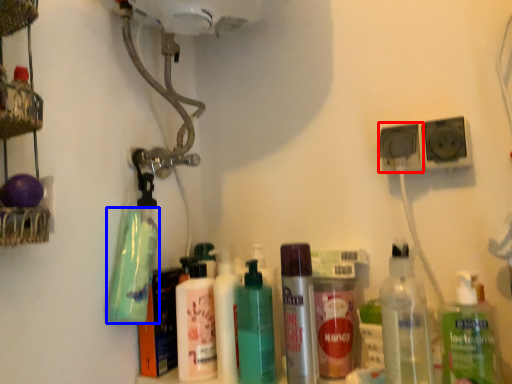
Question: Which object appears closest to the camera in this image, speaker (highlighted by a red box) or cleaning product (highlighted by a blue box)?

Choices:
 (A) speaker
 (B) cleaning product

Answer: (B)